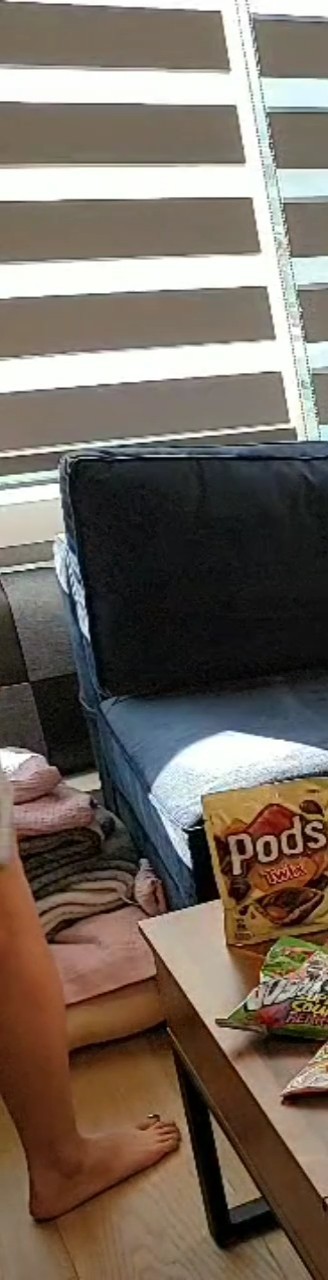
Where is `wooden floor`? This screenshot has height=1280, width=328. wooden floor is located at coordinates (161, 1243).